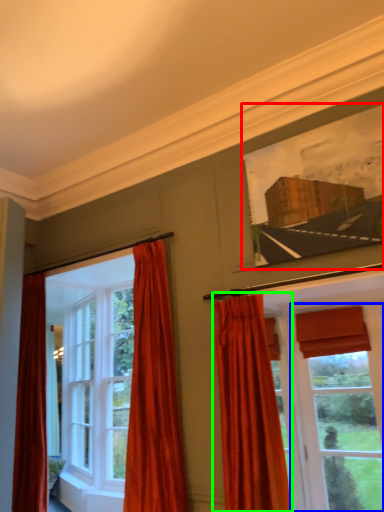
Question: Considering the real-world distances, which object is farthest from picture frame (highlighted by a red box)? window (highlighted by a blue box) or curtain (highlighted by a green box)?

Choices:
 (A) window
 (B) curtain

Answer: (A)